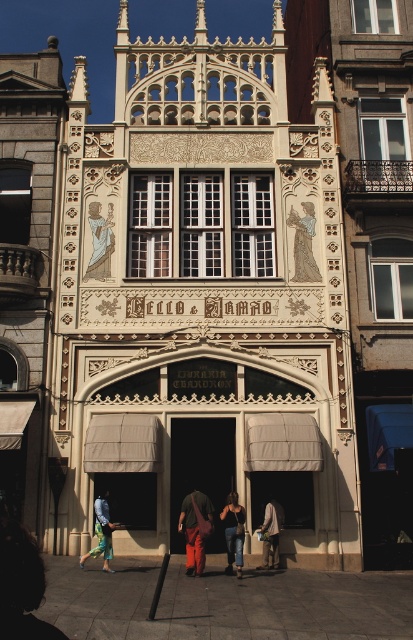
How far apart are matte orange pants at center and denim jeans at center?

5.56 feet

Who is higher up, matte orange pants at center or denim jeans at center?

denim jeans at center is higher up.

Where is `matte orange pants at center`? Image resolution: width=413 pixels, height=640 pixels. matte orange pants at center is located at coordinates (196, 529).

Between denim jeans at center and denim pants at lower center, which one is positioned lower?

denim jeans at center is below.

Can you confirm if denim jeans at center is shorter than denim pants at lower center?

In fact, denim jeans at center may be taller than denim pants at lower center.

Find the location of a particular element. The height and width of the screenshot is (640, 413). denim jeans at center is located at coordinates (234, 532).

Who is taller, matte gray figure at center or denim jeans at center?

denim jeans at center

The width and height of the screenshot is (413, 640). What do you see at coordinates (303, 243) in the screenshot?
I see `matte gray figure at center` at bounding box center [303, 243].

Which is behind, point (310, 264) or point (234, 522)?

The point (310, 264) is more distant.

At what (x,y) coordinates should I click in order to perform the action: click on matte gray figure at center. Please return your answer as a coordinate pair (x, y). The width and height of the screenshot is (413, 640). Looking at the image, I should click on (303, 243).